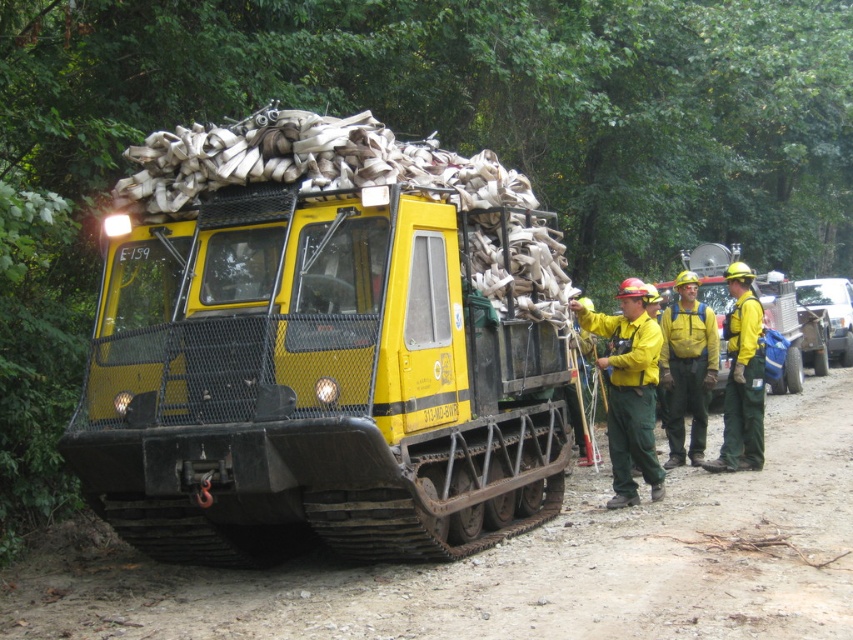
Question: Is yellow matte truck at center wider than yellow hard hat at center?

Choices:
 (A) no
 (B) yes

Answer: (B)

Question: Estimate the real-world distances between objects in this image. Which object is farther from the yellow hard hat at center?

Choices:
 (A) yellow reflective uniform at center
 (B) yellow/yellow-green uniform at center-right

Answer: (A)

Question: Which of these objects is positioned farthest from the dirt track at lower center?

Choices:
 (A) yellow hard hat at center
 (B) yellow matte truck at center

Answer: (A)

Question: Is yellow matte truck at center closer to the viewer compared to dirt track at lower center?

Choices:
 (A) yes
 (B) no

Answer: (B)

Question: Does yellow hard hat at center have a greater width compared to yellow/yellow-green uniform at center-right?

Choices:
 (A) no
 (B) yes

Answer: (B)

Question: Which object is the farthest from the dirt track at lower center?

Choices:
 (A) yellow reflective uniform at center
 (B) yellow hard hat at center
 (C) yellow/yellow-green uniform at center-right

Answer: (A)